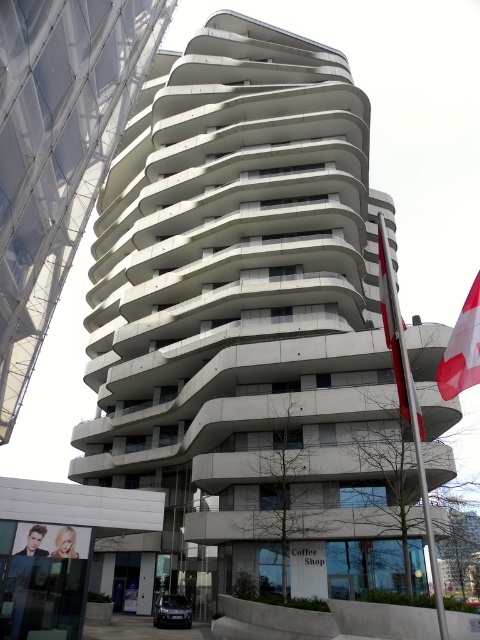
Question: Can you confirm if red fabric flag at right is positioned above red and white striped flag at upper right?

Choices:
 (A) yes
 (B) no

Answer: (A)

Question: Which object is closer to the camera taking this photo?

Choices:
 (A) red fabric flag at right
 (B) red and white striped flag at upper right

Answer: (B)

Question: Does red fabric flag at right lie in front of red and white striped flag at upper right?

Choices:
 (A) yes
 (B) no

Answer: (B)

Question: Which point appears farthest from the camera in this image?

Choices:
 (A) (445, 372)
 (B) (403, 371)

Answer: (A)

Question: Does red fabric flag at right appear on the left side of red and white striped flag at upper right?

Choices:
 (A) no
 (B) yes

Answer: (A)

Question: Among these points, which one is nearest to the camera?

Choices:
 (A) (460, 314)
 (B) (404, 403)

Answer: (B)